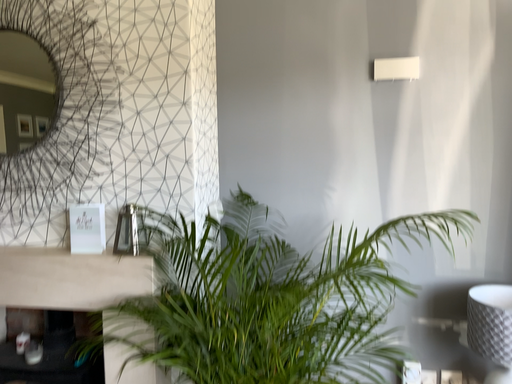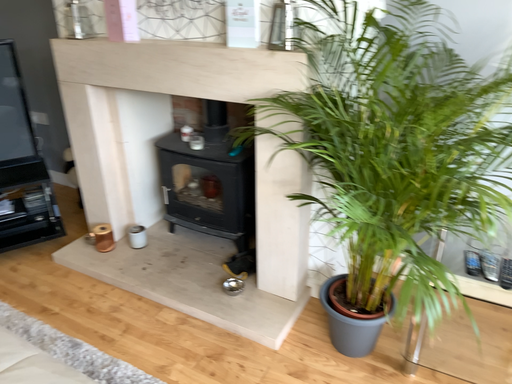
Question: How did the camera likely rotate when shooting the video?

Choices:
 (A) rotated left
 (B) rotated right

Answer: (A)